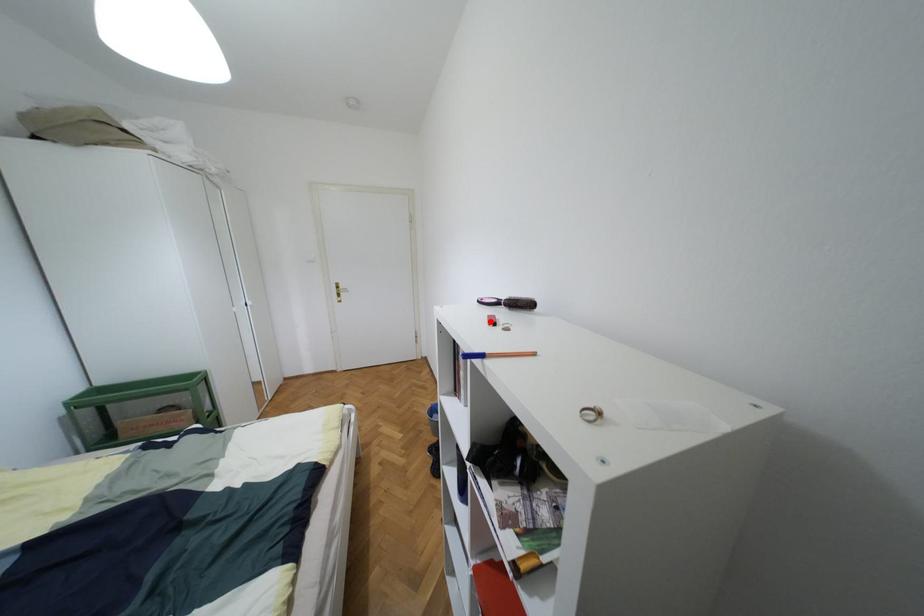
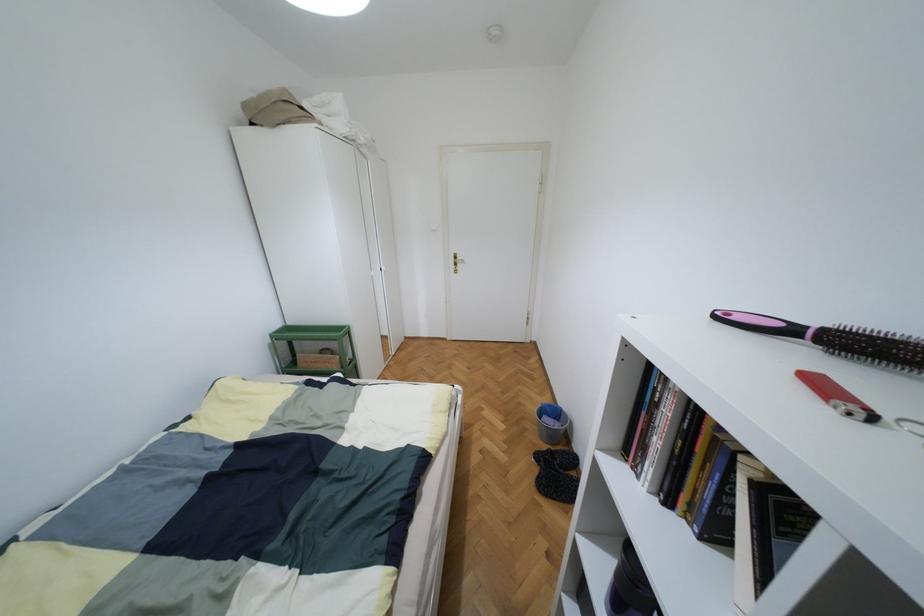
Find the pixel in the second image that matches the highlighted location in the first image.

(854, 408)